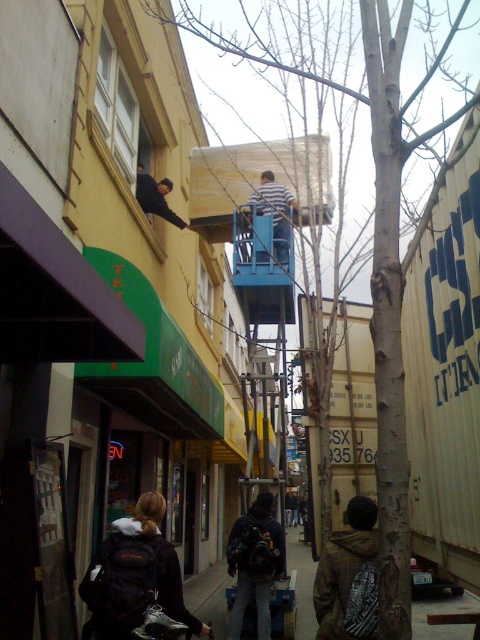
Is black backpack at lower left to the left of concrete sidewalk at lower center from the viewer's perspective?

Indeed, black backpack at lower left is positioned on the left side of concrete sidewalk at lower center.

Measure the distance between point (92,609) and camera.

A distance of 3.78 meters exists between point (92,609) and camera.

Find the location of a particular element. black backpack at lower left is located at coordinates (134, 577).

Looking at this image, does dark blue backpack at center appear on the right side of dark blue jeans at upper left?

Correct, you'll find dark blue backpack at center to the right of dark blue jeans at upper left.

Which is more to the right, dark blue backpack at center or dark blue jeans at upper left?

dark blue backpack at center

The image size is (480, 640). What do you see at coordinates (254, 563) in the screenshot?
I see `dark blue backpack at center` at bounding box center [254, 563].

Image resolution: width=480 pixels, height=640 pixels. I want to click on dark blue backpack at center, so click(254, 563).

Does point (456, 604) lie behind point (291, 195)?

That is True.

Can you confirm if concrete sidewalk at lower center is positioned to the left of striped shirt at center?

In fact, concrete sidewalk at lower center is to the right of striped shirt at center.

Is point (208, 577) positioned before point (295, 209)?

No.

Find the location of a particular element. Image resolution: width=480 pixels, height=640 pixels. concrete sidewalk at lower center is located at coordinates (208, 595).